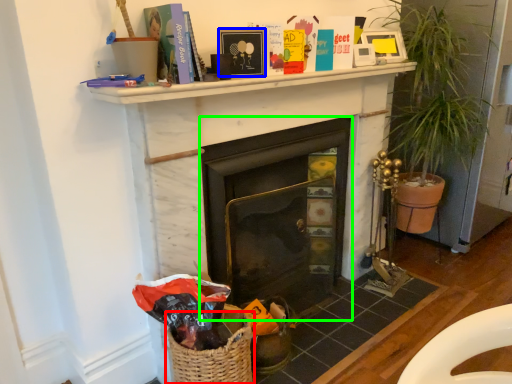
Question: Based on their relative distances, which object is nearer to basket (highlighted by a red box)? Choose from picture frame (highlighted by a blue box) and fireplace (highlighted by a green box).

Choices:
 (A) picture frame
 (B) fireplace

Answer: (B)